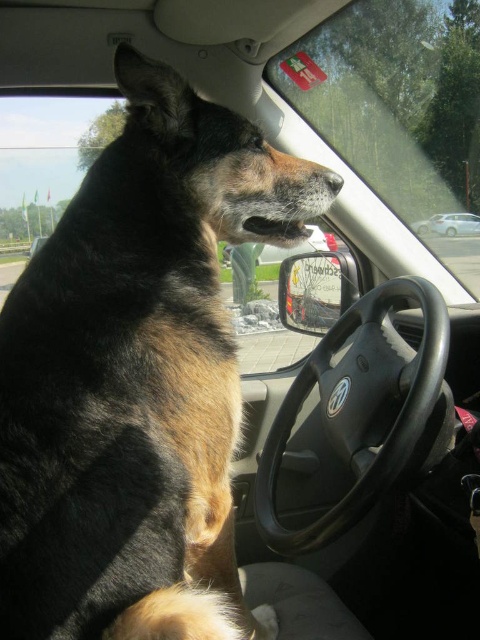
Looking at this image, does black leather steering wheel at center appear over metallic silver car at center?

Incorrect, black leather steering wheel at center is not positioned above metallic silver car at center.

What do you see at coordinates (284, 248) in the screenshot? I see `black leather steering wheel at center` at bounding box center [284, 248].

Where is `black leather steering wheel at center`? black leather steering wheel at center is located at coordinates (284, 248).

Can you confirm if transparent glass window at upper center is positioned above black smooth nose at center?

Yes, transparent glass window at upper center is above black smooth nose at center.

Is point (361, 4) positioned in front of point (332, 186)?

No, (361, 4) is further to viewer.

Locate an element on the screen. Image resolution: width=480 pixels, height=640 pixels. transparent glass window at upper center is located at coordinates (398, 108).

Who is shorter, black fur dog at left or metallic silver car at center?

metallic silver car at center

Can you confirm if black fur dog at left is positioned to the right of metallic silver car at center?

→ In fact, black fur dog at left is to the left of metallic silver car at center.

Does point (172, 435) come in front of point (443, 220)?

Yes.

This screenshot has width=480, height=640. In order to click on black fur dog at left in this screenshot , I will do `click(137, 378)`.